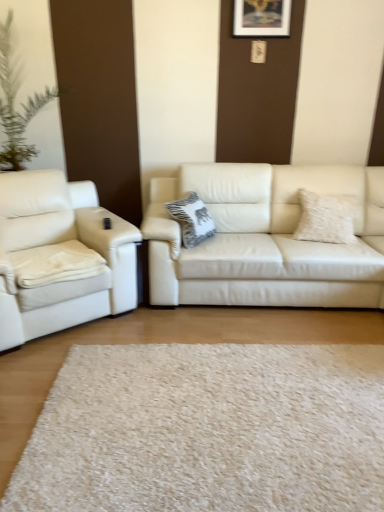
Question: Can you confirm if white textured pillow at center, the 1th pillow when ordered from left to right, is taller than matte white couch at center, acting as the first studio couch starting from the right?

Choices:
 (A) no
 (B) yes

Answer: (A)

Question: Can you confirm if white textured pillow at center, placed as the 2th pillow when sorted from right to left, is thinner than matte white couch at center, acting as the first studio couch starting from the right?

Choices:
 (A) no
 (B) yes

Answer: (B)

Question: Is white textured pillow at center, placed as the 2th pillow when sorted from right to left, looking in the opposite direction of matte white couch at center, acting as the second studio couch starting from the left?

Choices:
 (A) no
 (B) yes

Answer: (B)

Question: From the image's perspective, would you say white textured pillow at center, the 1th pillow when ordered from left to right, is shown under matte white couch at center, acting as the second studio couch starting from the left?

Choices:
 (A) yes
 (B) no

Answer: (B)

Question: Is white textured pillow at center, the 1th pillow when ordered from left to right, at the right side of matte white couch at center, acting as the second studio couch starting from the left?

Choices:
 (A) no
 (B) yes

Answer: (A)

Question: Is white textured pillow at center, placed as the 2th pillow when sorted from right to left, touching matte white couch at center, acting as the first studio couch starting from the right?

Choices:
 (A) no
 (B) yes

Answer: (A)

Question: Is fuzzy white pillow at right, the first pillow positioned from the right, positioned before white shag rug at center?

Choices:
 (A) yes
 (B) no

Answer: (B)

Question: Can you see fuzzy white pillow at right, the first pillow positioned from the right, touching white shag rug at center?

Choices:
 (A) no
 (B) yes

Answer: (A)

Question: Is fuzzy white pillow at right, the first pillow positioned from the right, further to camera compared to white shag rug at center?

Choices:
 (A) no
 (B) yes

Answer: (B)

Question: From a real-world perspective, is fuzzy white pillow at right, acting as the second pillow starting from the left, on top of white shag rug at center?

Choices:
 (A) yes
 (B) no

Answer: (A)

Question: Does fuzzy white pillow at right, acting as the second pillow starting from the left, have a smaller size compared to white shag rug at center?

Choices:
 (A) no
 (B) yes

Answer: (B)

Question: From the image's perspective, would you say fuzzy white pillow at right, the first pillow positioned from the right, is shown under white shag rug at center?

Choices:
 (A) yes
 (B) no

Answer: (B)

Question: Is wooden picture frame at upper center to the right of fuzzy white pillow at right, acting as the second pillow starting from the left, from the viewer's perspective?

Choices:
 (A) yes
 (B) no

Answer: (B)